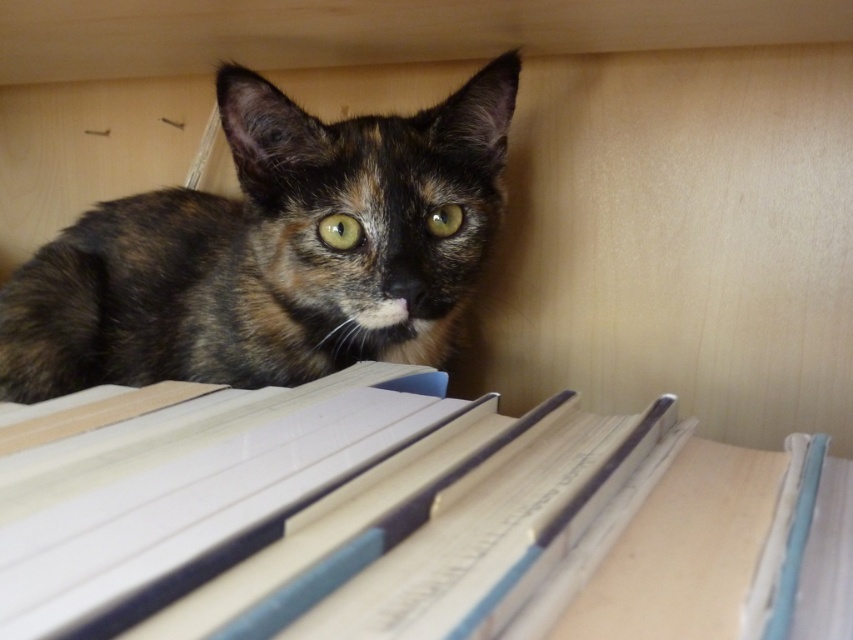
Which is above, hardcover book at center or tortoiseshell fur cat at upper center?

Positioned higher is tortoiseshell fur cat at upper center.

Between hardcover book at center and tortoiseshell fur cat at upper center, which one has less height?

hardcover book at center

Describe the element at coordinates (392, 516) in the screenshot. I see `hardcover book at center` at that location.

Locate an element on the screen. hardcover book at center is located at coordinates (392, 516).